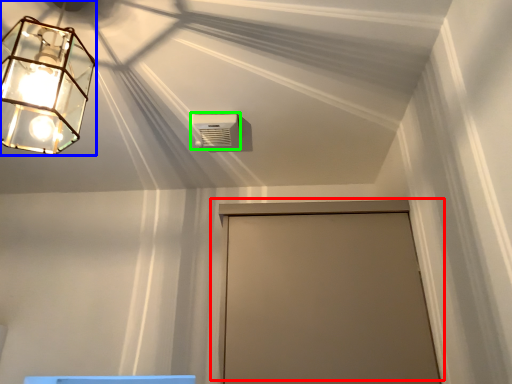
Question: Considering the real-world distances, which object is closest to door (highlighted by a red box)? lamp (highlighted by a blue box) or air conditioning (highlighted by a green box).

Choices:
 (A) lamp
 (B) air conditioning

Answer: (B)